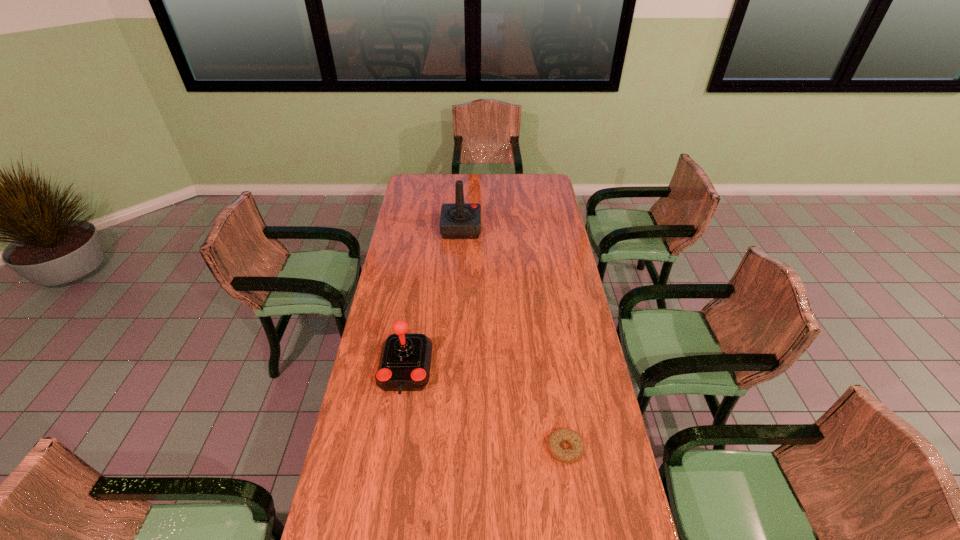
The height and width of the screenshot is (540, 960). Find the location of `object at the right edge`. object at the right edge is located at coordinates (558, 436).

The height and width of the screenshot is (540, 960). I want to click on vacant space at the far edge of the desktop, so click(x=492, y=186).

The image size is (960, 540). In the image, there is a desktop. In order to click on free space at the left edge in this screenshot , I will do `click(366, 362)`.

Find the location of `vacant space at the right edge`. vacant space at the right edge is located at coordinates (535, 200).

Locate an element on the screen. vacant space at the far left corner of the desktop is located at coordinates (422, 186).

Identify the location of free location at the far right corner of the desktop. The height and width of the screenshot is (540, 960). (532, 188).

I want to click on vacant area that lies between the shortest object and the nearer joystick, so click(485, 408).

Locate an element on the screen. This screenshot has height=540, width=960. empty location between the shortest object and the shorter joystick is located at coordinates (485, 408).

Locate an element on the screen. empty location between the second tallest object and the bagel is located at coordinates (485, 408).

Where is `free space between the shorter joystick and the tallest object`? Image resolution: width=960 pixels, height=540 pixels. free space between the shorter joystick and the tallest object is located at coordinates (433, 299).